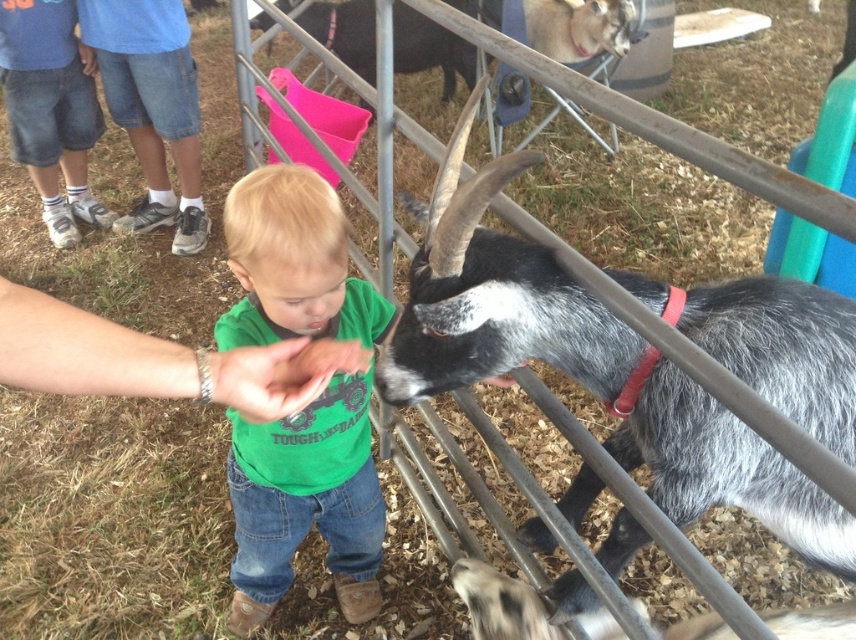
Question: Does gray speckled fur at center lie behind green cotton shirt at center?

Choices:
 (A) no
 (B) yes

Answer: (B)

Question: Is gray speckled fur at center thinner than green cotton shirt at center?

Choices:
 (A) no
 (B) yes

Answer: (A)

Question: Which point is farther to the camera?

Choices:
 (A) (348, 396)
 (B) (750, 314)

Answer: (A)

Question: Can you confirm if gray speckled fur at center is wider than green cotton shirt at center?

Choices:
 (A) no
 (B) yes

Answer: (B)